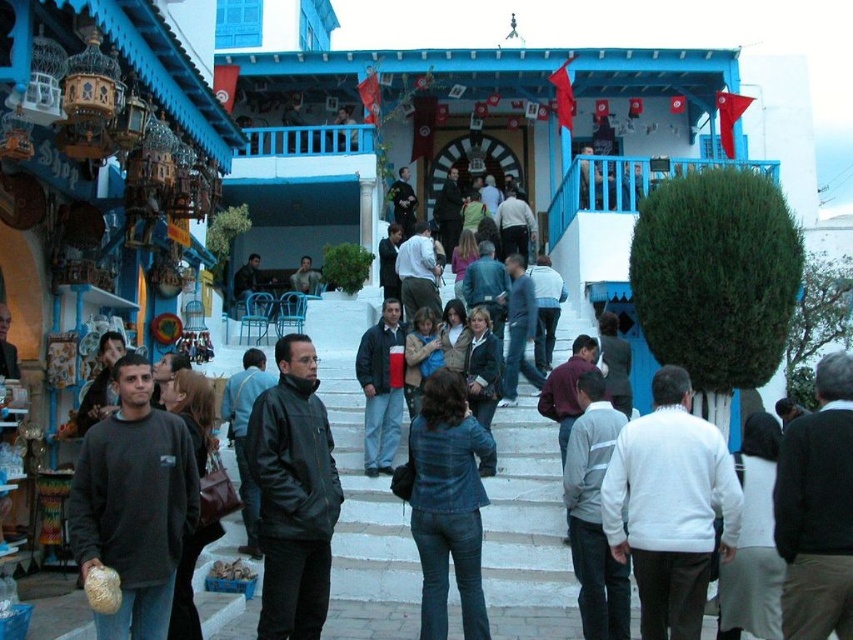
Looking at this image, you are a tourist in the Mediterranean town square and see both the dark gray sweater at center and the dark gray jacket at center. Which item is closer to you?

The dark gray sweater at center is closer to you because it is in front of the dark gray jacket at center.

You are a tourist standing in the town square and want to pick up both the white matte sweater at center and the dark gray jacket at center. Given that you can only carry one item at a time, which item should you pick first to minimize the distance you have to walk back to retrieve the second item?

You should pick up the white matte sweater at center first because it is closer to the dark gray jacket at center than the other way around, so retrieving it first would minimize the total distance walked.